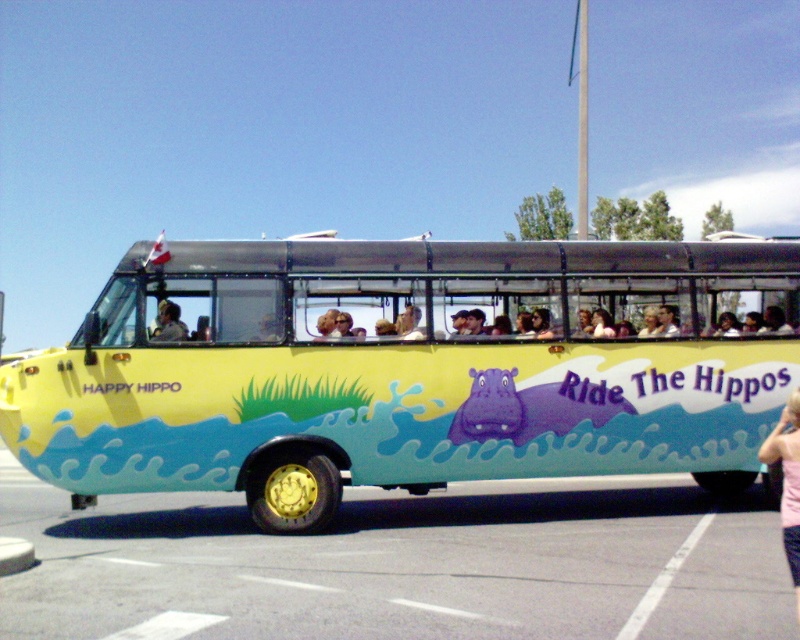
Does smooth asphalt parking lot at lower center have a lesser width compared to pink fabric at lower right?

No, smooth asphalt parking lot at lower center is not thinner than pink fabric at lower right.

Between point (742, 563) and point (796, 452), which one is positioned in front?

Point (796, 452) is more forward.

Between point (501, 596) and point (774, 448), which one is positioned behind?

Point (501, 596)

I want to click on smooth asphalt parking lot at lower center, so click(404, 563).

Between yellow matte bus at center and smooth asphalt parking lot at lower center, which one has more height?

yellow matte bus at center is taller.

This screenshot has height=640, width=800. What are the coordinates of `yellow matte bus at center` in the screenshot? It's located at (412, 369).

Does smooth asphalt parking lot at lower center have a greater width compared to light brown leather jacket at center?

Indeed, smooth asphalt parking lot at lower center has a greater width compared to light brown leather jacket at center.

Which of these two, smooth asphalt parking lot at lower center or light brown leather jacket at center, stands taller?

smooth asphalt parking lot at lower center

Image resolution: width=800 pixels, height=640 pixels. What do you see at coordinates (404, 563) in the screenshot? I see `smooth asphalt parking lot at lower center` at bounding box center [404, 563].

What are the coordinates of `smooth asphalt parking lot at lower center` in the screenshot? It's located at (404, 563).